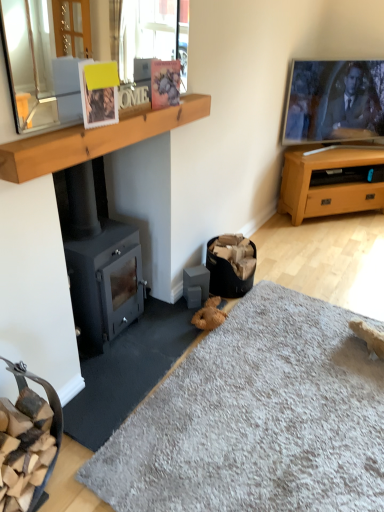
I want to click on wooden at upper center, so click(x=93, y=140).

This screenshot has width=384, height=512. Describe the element at coordinates (93, 140) in the screenshot. I see `wooden at upper center` at that location.

From the picture: What is the approximate height of soft gray carpet at lower center?

2.19 inches.

In order to face matte plastic picture frame at upper center, the 2th picture frame when ordered from front to back, should I rotate leftwards or rightwards?

You should rotate left by 3.488 degrees.

Where is `light brown wood tv stand at right`? light brown wood tv stand at right is located at coordinates (332, 181).

Measure the distance between flat-screen tv at upper right and soft gray carpet at lower center.

flat-screen tv at upper right and soft gray carpet at lower center are 1.97 meters apart.

Which is in front, point (303, 161) or point (228, 428)?

The point (228, 428) is closer.

Find the location of a particular element. The image size is (384, 512). cat bed below the flat-screen tv at upper right (from a real-world perspective) is located at coordinates click(x=256, y=419).

From the picture: Considering the relative positions of white matte picture frame at upper center, which is the second picture frame in right-to-left order, and flat-screen tv at upper right in the image provided, is white matte picture frame at upper center, which is the second picture frame in right-to-left order, to the left of flat-screen tv at upper right from the viewer's perspective?

Yes.

Does point (117, 111) come closer to viewer compared to point (359, 109)?

Yes, point (117, 111) is in front of point (359, 109).

Which of these two, white matte picture frame at upper center, which is the second picture frame in right-to-left order, or flat-screen tv at upper right, is thinner?

With smaller width is white matte picture frame at upper center, which is the second picture frame in right-to-left order.

Considering the relative sizes of white matte picture frame at upper center, which is the second picture frame in back-to-front order, and matte plastic picture frame at upper center, which is the first picture frame from right to left, in the image provided, is white matte picture frame at upper center, which is the second picture frame in back-to-front order, taller than matte plastic picture frame at upper center, which is the first picture frame from right to left,?

Yes, white matte picture frame at upper center, which is the second picture frame in back-to-front order, is taller than matte plastic picture frame at upper center, which is the first picture frame from right to left.

Where is `picture frame on the left of matte plastic picture frame at upper center, arranged as the 2th picture frame when viewed from the left`? picture frame on the left of matte plastic picture frame at upper center, arranged as the 2th picture frame when viewed from the left is located at coordinates (99, 93).

Who is more distant, white matte picture frame at upper center, which appears as the 1th picture frame when viewed from the front, or matte plastic picture frame at upper center, the 2th picture frame when ordered from front to back?

Positioned behind is matte plastic picture frame at upper center, the 2th picture frame when ordered from front to back.

Does point (83, 80) come farther from viewer compared to point (177, 90)?

No.

Are clear glass mirror at upper left and wooden at upper center located far from each other?

No, there isn't a large distance between clear glass mirror at upper left and wooden at upper center.

How distant is clear glass mirror at upper left from wooden at upper center?

clear glass mirror at upper left is 8.36 inches away from wooden at upper center.

From the image's perspective, would you say clear glass mirror at upper left is shown under wooden at upper center?

No.

Where is `cat bed below the matte black wood burning stove at left (from a real-world perspective)`? This screenshot has height=512, width=384. cat bed below the matte black wood burning stove at left (from a real-world perspective) is located at coordinates (256, 419).

Is matte black wood burning stove at left located within soft gray carpet at lower center?

Actually, matte black wood burning stove at left is outside soft gray carpet at lower center.

Are soft gray carpet at lower center and matte black wood burning stove at left beside each other?

soft gray carpet at lower center and matte black wood burning stove at left are not in contact.

Looking at their sizes, would you say flat-screen tv at upper right is wider or thinner than matte black wood burning stove at left?

In the image, flat-screen tv at upper right appears to be more narrow than matte black wood burning stove at left.

Where is `entertainment center that is above the matte black wood burning stove at left (from the image's perspective)`? The width and height of the screenshot is (384, 512). entertainment center that is above the matte black wood burning stove at left (from the image's perspective) is located at coordinates (336, 104).

Would you say matte black wood burning stove at left is part of flat-screen tv at upper right's contents?

Definitely not — matte black wood burning stove at left is not inside flat-screen tv at upper right.

From a real-world perspective, which is physically below, wooden at upper center or flat-screen tv at upper right?

flat-screen tv at upper right is physically lower.

Is flat-screen tv at upper right surrounded by wooden at upper center?

Actually, flat-screen tv at upper right is outside wooden at upper center.

Between point (87, 138) and point (297, 104), which one is positioned behind?

The point (297, 104) is behind.

This screenshot has height=512, width=384. What are the coordinates of `entertainment center that appears on the right of wooden at upper center` in the screenshot? It's located at (336, 104).

Where is `cat bed below the flat-screen tv at upper right (from a real-world perspective)`? This screenshot has height=512, width=384. cat bed below the flat-screen tv at upper right (from a real-world perspective) is located at coordinates (256, 419).

Where is `the 2nd picture frame to the left of the flat-screen tv at upper right, starting your count from the anchor`? This screenshot has width=384, height=512. the 2nd picture frame to the left of the flat-screen tv at upper right, starting your count from the anchor is located at coordinates tap(99, 93).

Which object lies nearer to the anchor point white matte picture frame at upper center, which is the first picture frame in left-to-right order, flat-screen tv at upper right or matte plastic picture frame at upper center, arranged as the 2th picture frame when viewed from the left?

The object closer to white matte picture frame at upper center, which is the first picture frame in left-to-right order, is matte plastic picture frame at upper center, arranged as the 2th picture frame when viewed from the left.

From the image, which object appears to be farther from clear glass mirror at upper left, soft gray carpet at lower center or matte plastic picture frame at upper center, arranged as the 2th picture frame when viewed from the left?

soft gray carpet at lower center is further to clear glass mirror at upper left.

Based on their spatial positions, is light brown wood tv stand at right or flat-screen tv at upper right closer to matte plastic picture frame at upper center, acting as the first picture frame starting from the back?

The object closer to matte plastic picture frame at upper center, acting as the first picture frame starting from the back, is flat-screen tv at upper right.

Based on their spatial positions, is wooden at upper center or soft gray carpet at lower center further from light brown wood tv stand at right?

Among the two, wooden at upper center is located further to light brown wood tv stand at right.

Estimate the real-world distances between objects in this image. Which object is further from soft gray carpet at lower center, clear glass mirror at upper left or light brown wood tv stand at right?

light brown wood tv stand at right is positioned further to the anchor soft gray carpet at lower center.

Based on their spatial positions, is flat-screen tv at upper right or soft gray carpet at lower center further from clear glass mirror at upper left?

flat-screen tv at upper right lies further to clear glass mirror at upper left than the other object.

From the image, which object appears to be farther from matte plastic picture frame at upper center, acting as the first picture frame starting from the back, white matte picture frame at upper center, which appears as the 1th picture frame when viewed from the front, or flat-screen tv at upper right?

The object further to matte plastic picture frame at upper center, acting as the first picture frame starting from the back, is flat-screen tv at upper right.

From the image, which object appears to be farther from clear glass mirror at upper left, flat-screen tv at upper right or white matte picture frame at upper center, which is the first picture frame in left-to-right order?

flat-screen tv at upper right lies further to clear glass mirror at upper left than the other object.

This screenshot has width=384, height=512. What are the coordinates of `wood burning stove located between wooden at upper center and light brown wood tv stand at right in the depth direction` in the screenshot? It's located at (100, 264).

This screenshot has height=512, width=384. Find the location of `wood burning stove that lies between matte plastic picture frame at upper center, acting as the first picture frame starting from the back, and soft gray carpet at lower center from top to bottom`. wood burning stove that lies between matte plastic picture frame at upper center, acting as the first picture frame starting from the back, and soft gray carpet at lower center from top to bottom is located at coordinates (100, 264).

You are a GUI agent. You are given a task and a screenshot of the screen. Output one action in this format:
    pyautogui.click(x=<x>, y=<y>)
    Task: Click on the mantle between soft gray carpet at lower center and light brown wood tv stand at right along the z-axis
    
    Given the screenshot: What is the action you would take?
    pyautogui.click(x=93, y=140)

Identify the location of entertainment center between matte plastic picture frame at upper center, acting as the first picture frame starting from the back, and light brown wood tv stand at right, along the z-axis. (336, 104).